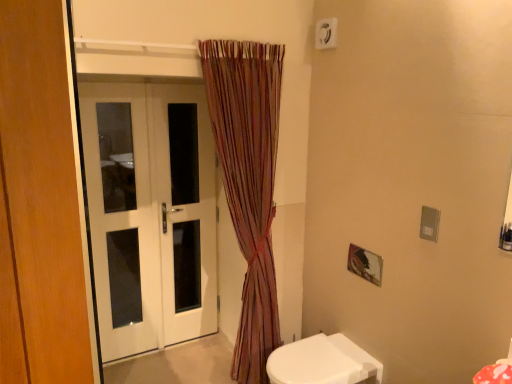
Question: Considering their positions, is striped fabric curtain at center located in front of or behind white glossy toilet at lower right?

Choices:
 (A) front
 (B) behind

Answer: (B)

Question: Is striped fabric curtain at center taller or shorter than white glossy toilet at lower right?

Choices:
 (A) short
 (B) tall

Answer: (B)

Question: Which is farther from the white plastic electric outlet at upper center?

Choices:
 (A) white glossy toilet at lower right
 (B) striped fabric curtain at center
 (C) white glossy door at left
 (D) white glossy door at left

Answer: (A)

Question: Which object is positioned closest to the white plastic electric outlet at upper center?

Choices:
 (A) striped fabric curtain at center
 (B) white glossy door at left
 (C) white glossy toilet at lower right
 (D) white glossy door at left

Answer: (A)